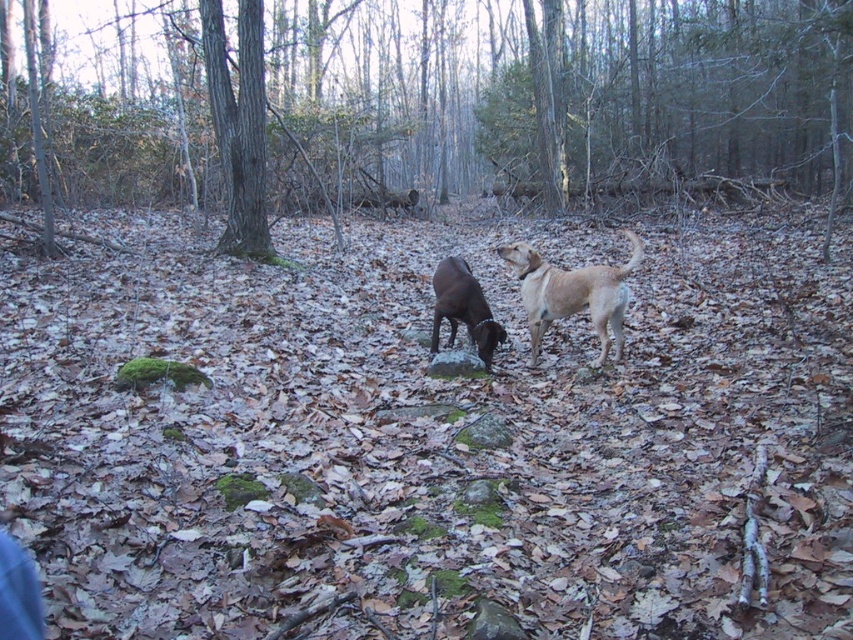
Can you confirm if smooth bark tree at center is positioned below shiny black dog at center?

Actually, smooth bark tree at center is above shiny black dog at center.

Is point (227, 172) positioned after point (456, 312)?

Yes, it is behind point (456, 312).

Find the location of a particular element. The image size is (853, 640). smooth bark tree at center is located at coordinates (456, 106).

Is brown rough bark tree at center positioned before light brown fur at center?

No, brown rough bark tree at center is behind light brown fur at center.

Which of these two, brown rough bark tree at center or light brown fur at center, stands taller?

brown rough bark tree at center

Does point (254, 164) come in front of point (614, 314)?

No.

Image resolution: width=853 pixels, height=640 pixels. I want to click on brown rough bark tree at center, so click(239, 125).

Can you confirm if light brown fur at center is positioned to the left of shiny black dog at center?

No, light brown fur at center is not to the left of shiny black dog at center.

Locate an element on the screen. The width and height of the screenshot is (853, 640). light brown fur at center is located at coordinates (572, 292).

Identify the location of light brown fur at center. (572, 292).